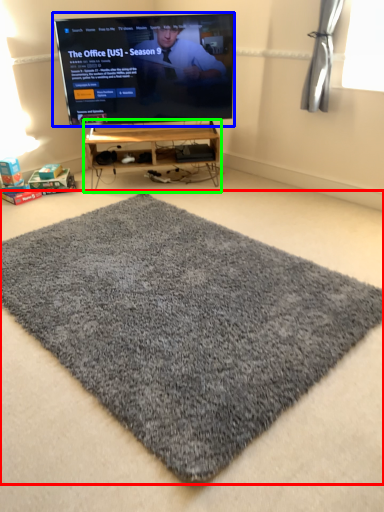
Question: Which object is the closest to the mat (highlighted by a red box)? Choose among these: television (highlighted by a blue box) or furniture (highlighted by a green box).

Choices:
 (A) television
 (B) furniture

Answer: (B)